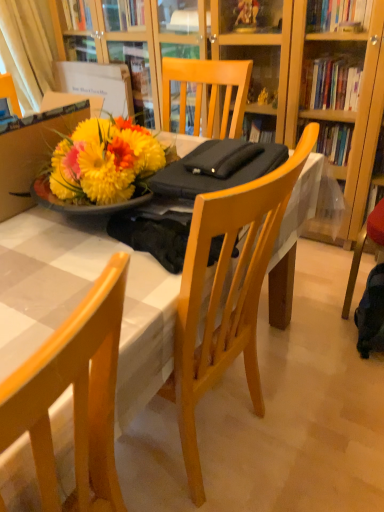
Describe the element at coordinates (371, 314) in the screenshot. The image size is (384, 512). I see `dark blue fabric backpack at lower right` at that location.

Image resolution: width=384 pixels, height=512 pixels. What are the coordinates of `white glossy table at center` in the screenshot? It's located at (81, 298).

From the image's perspective, does wooden chair at center appear higher than white fabric curtain at upper left?

No, from the image's perspective, wooden chair at center is not above white fabric curtain at upper left.

Between wooden chair at center and white fabric curtain at upper left, which one has larger size?

With larger size is wooden chair at center.

Considering the sizes of objects wooden chair at center and white fabric curtain at upper left in the image provided, who is thinner, wooden chair at center or white fabric curtain at upper left?

white fabric curtain at upper left is thinner.

Considering the sizes of objects white fabric curtain at upper left and wooden chair at center in the image provided, who is bigger, white fabric curtain at upper left or wooden chair at center?

wooden chair at center is bigger.

Is wooden chair at center completely or partially inside white fabric curtain at upper left?

No.

Is white fabric curtain at upper left directly adjacent to wooden chair at center?

No, white fabric curtain at upper left is not touching wooden chair at center.

Which of these two, white glossy table at center or wooden chair at center, is wider?

white glossy table at center.

Considering the relative sizes of white glossy table at center and wooden chair at center in the image provided, is white glossy table at center shorter than wooden chair at center?

No.

Measure the distance between white glossy table at center and wooden chair at center.

The distance of white glossy table at center from wooden chair at center is 20.36 centimeters.

Is white glossy table at center bigger or smaller than dark blue fabric backpack at lower right?

Considering their sizes, white glossy table at center takes up more space than dark blue fabric backpack at lower right.

From a real-world perspective, is white glossy table at center under dark blue fabric backpack at lower right?

No, from a real-world perspective, white glossy table at center is not under dark blue fabric backpack at lower right.

From the image's perspective, which is above, white glossy table at center or dark blue fabric backpack at lower right?

white glossy table at center, from the image's perspective.

Which point is more forward, (x=9, y=62) or (x=135, y=375)?

Point (x=135, y=375)

Which is behind, white fabric curtain at upper left or white glossy table at center?

Positioned behind is white fabric curtain at upper left.

From the image's perspective, does white fabric curtain at upper left appear higher than white glossy table at center?

Yes, from the image's perspective, white fabric curtain at upper left is on top of white glossy table at center.

Looking at the image, does white fabric curtain at upper left seem bigger or smaller compared to white glossy table at center?

white fabric curtain at upper left is smaller than white glossy table at center.

Is white glossy table at center oriented towards white fabric curtain at upper left?

No.

Locate an element on the screen. The height and width of the screenshot is (512, 384). curtain on the left of the white glossy table at center is located at coordinates (28, 48).

From the image's perspective, which is below, white glossy table at center or white fabric curtain at upper left?

white glossy table at center is shown below in the image.

Considering the relative sizes of dark blue fabric backpack at lower right and wooden chair at center in the image provided, is dark blue fabric backpack at lower right shorter than wooden chair at center?

Indeed, dark blue fabric backpack at lower right has a lesser height compared to wooden chair at center.

Is dark blue fabric backpack at lower right looking in the opposite direction of wooden chair at center?

No, dark blue fabric backpack at lower right's orientation is not away from wooden chair at center.

From a real-world perspective, is dark blue fabric backpack at lower right over wooden chair at center?

Actually, dark blue fabric backpack at lower right is physically below wooden chair at center in the real world.

Which of these two, dark blue fabric backpack at lower right or wooden chair at center, is wider?

wooden chair at center.

This screenshot has height=512, width=384. In order to click on curtain behind the wooden chair at center in this screenshot , I will do `click(28, 48)`.

At what (x,y) coordinates should I click in order to perform the action: click on curtain lying above the wooden chair at center (from the image's perspective). Please return your answer as a coordinate pair (x, y). Looking at the image, I should click on (28, 48).

From the image, which object appears to be farther from white glossy table at center, dark blue fabric backpack at lower right or wooden chair at center?

Based on the image, dark blue fabric backpack at lower right appears to be further to white glossy table at center.

When comparing their distances from white glossy table at center, does wooden chair at center or dark blue fabric backpack at lower right seem closer?

Among the two, wooden chair at center is located nearer to white glossy table at center.

Which object lies further to the anchor point dark blue fabric backpack at lower right, white fabric curtain at upper left or wooden chair at center?

Among the two, white fabric curtain at upper left is located further to dark blue fabric backpack at lower right.

Considering their positions, is white glossy table at center positioned closer to white fabric curtain at upper left than dark blue fabric backpack at lower right?

Based on the image, white glossy table at center appears to be nearer to white fabric curtain at upper left.

Estimate the real-world distances between objects in this image. Which object is further from white glossy table at center, white fabric curtain at upper left or dark blue fabric backpack at lower right?

Among the two, white fabric curtain at upper left is located further to white glossy table at center.

Looking at this image, when comparing their distances from white fabric curtain at upper left, does wooden chair at center or white glossy table at center seem closer?

The object closer to white fabric curtain at upper left is white glossy table at center.

Based on their spatial positions, is wooden chair at center or white fabric curtain at upper left closer to dark blue fabric backpack at lower right?

wooden chair at center.

Considering their positions, is dark blue fabric backpack at lower right positioned closer to white fabric curtain at upper left than wooden chair at center?

dark blue fabric backpack at lower right lies closer to white fabric curtain at upper left than the other object.

Image resolution: width=384 pixels, height=512 pixels. In order to click on desk between white fabric curtain at upper left and dark blue fabric backpack at lower right from left to right in this screenshot , I will do `click(81, 298)`.

Identify the location of desk positioned between wooden chair at center and white fabric curtain at upper left from near to far. This screenshot has height=512, width=384. (81, 298).

At what (x,y) coordinates should I click in order to perform the action: click on desk between wooden chair at center and dark blue fabric backpack at lower right from front to back. Please return your answer as a coordinate pair (x, y). The image size is (384, 512). Looking at the image, I should click on (81, 298).

At what (x,y) coordinates should I click in order to perform the action: click on backpack between wooden chair at center and white fabric curtain at upper left in the front-back direction. Please return your answer as a coordinate pair (x, y). Looking at the image, I should click on (371, 314).